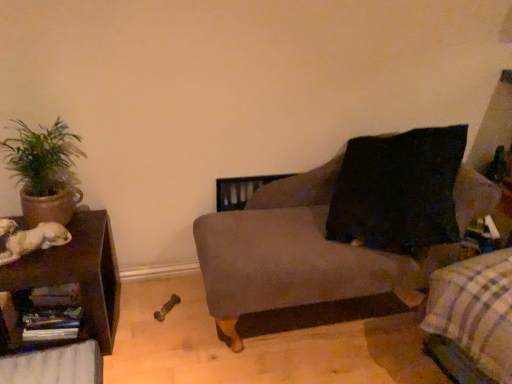
Question: Considering the relative sizes of green leafy plant in clay pot at left and white fur dog at left in the image provided, is green leafy plant in clay pot at left bigger than white fur dog at left?

Choices:
 (A) yes
 (B) no

Answer: (A)

Question: Does green leafy plant in clay pot at left have a lesser height compared to white fur dog at left?

Choices:
 (A) no
 (B) yes

Answer: (A)

Question: From the image's perspective, is green leafy plant in clay pot at left located beneath white fur dog at left?

Choices:
 (A) no
 (B) yes

Answer: (A)

Question: Is green leafy plant in clay pot at left not within white fur dog at left?

Choices:
 (A) no
 (B) yes

Answer: (B)

Question: Is green leafy plant in clay pot at left positioned with its back to white fur dog at left?

Choices:
 (A) yes
 (B) no

Answer: (B)

Question: Does green leafy plant in clay pot at left appear on the left side of white fur dog at left?

Choices:
 (A) no
 (B) yes

Answer: (A)

Question: Is plaid fabric at lower right positioned far away from velvet gray couch at center?

Choices:
 (A) no
 (B) yes

Answer: (A)

Question: Is plaid fabric at lower right next to velvet gray couch at center?

Choices:
 (A) no
 (B) yes

Answer: (A)

Question: Does plaid fabric at lower right have a lesser height compared to velvet gray couch at center?

Choices:
 (A) no
 (B) yes

Answer: (B)

Question: Is plaid fabric at lower right completely or partially outside of velvet gray couch at center?

Choices:
 (A) no
 (B) yes

Answer: (B)

Question: From a real-world perspective, does plaid fabric at lower right sit lower than velvet gray couch at center?

Choices:
 (A) no
 (B) yes

Answer: (B)

Question: Is plaid fabric at lower right smaller than velvet gray couch at center?

Choices:
 (A) yes
 (B) no

Answer: (A)

Question: From the image's perspective, would you say brown wood table at left is positioned over green leafy plant in clay pot at left?

Choices:
 (A) no
 (B) yes

Answer: (A)